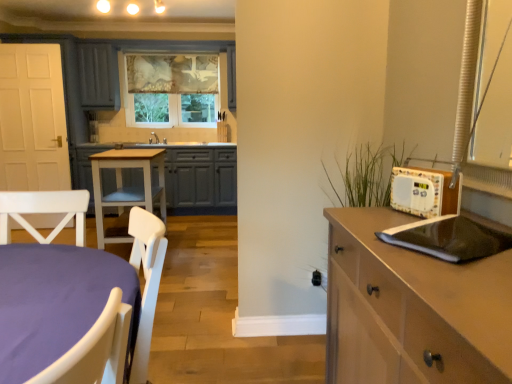
What do you see at coordinates (201, 179) in the screenshot?
I see `matte gray cabinet at center, positioned as the first cabinetry in top-to-bottom order` at bounding box center [201, 179].

At what (x,y) coordinates should I click in order to perform the action: click on textured fabric window at center. Please return your answer as a coordinate pair (x, y). This screenshot has width=512, height=384. Looking at the image, I should click on (170, 90).

Describe the element at coordinates (170, 90) in the screenshot. I see `textured fabric window at center` at that location.

The height and width of the screenshot is (384, 512). I want to click on matte gray cabinet at center, arranged as the second cabinetry when viewed from the right, so click(201, 179).

Locate an element on the screen. The height and width of the screenshot is (384, 512). kitchen appliance that is on the right side of white wood table at center is located at coordinates (448, 238).

Between white wood table at center and black matte laptop at right, which one appears on the left side from the viewer's perspective?

white wood table at center.

Looking at this image, is white wood table at center in front of black matte laptop at right?

No, the depth of white wood table at center is greater than that of black matte laptop at right.

Looking at this image, is the surface of white wood table at center in direct contact with black matte laptop at right?

No, white wood table at center is not making contact with black matte laptop at right.

How many degrees apart are the facing directions of light brown wood cabinet at right, which ranks as the 1th cabinetry in bottom-to-top order, and black matte laptop at right?

The angular difference between light brown wood cabinet at right, which ranks as the 1th cabinetry in bottom-to-top order, and black matte laptop at right is 33 degrees.

Is light brown wood cabinet at right, placed as the first cabinetry when sorted from right to left, to the left or to the right of black matte laptop at right in the image?

From the image, it's evident that light brown wood cabinet at right, placed as the first cabinetry when sorted from right to left, is to the left of black matte laptop at right.

From a real-world perspective, who is located higher, light brown wood cabinet at right, positioned as the 2th cabinetry in back-to-front order, or black matte laptop at right?

From a 3D spatial view, black matte laptop at right is above.

Looking at this image, which of these two, light brown wood cabinet at right, positioned as the 2th cabinetry in back-to-front order, or black matte laptop at right, is wider?

light brown wood cabinet at right, positioned as the 2th cabinetry in back-to-front order.

Locate an element on the screen. window above the matte gray cabinet at center, the 2th cabinetry when ordered from bottom to top (from a real-world perspective) is located at coordinates (170, 90).

Is matte gray cabinet at center, arranged as the second cabinetry when viewed from the right, positioned beyond the bounds of textured fabric window at center?

Absolutely, matte gray cabinet at center, arranged as the second cabinetry when viewed from the right, is external to textured fabric window at center.

In terms of height, does light brown wood cabinet at right, placed as the first cabinetry when sorted from right to left, look taller or shorter compared to matte gray cabinet at center, positioned as the first cabinetry in top-to-bottom order?

light brown wood cabinet at right, placed as the first cabinetry when sorted from right to left, is shorter than matte gray cabinet at center, positioned as the first cabinetry in top-to-bottom order.

Locate an element on the screen. cabinetry on the right of matte gray cabinet at center, the 2th cabinetry when ordered from bottom to top is located at coordinates (412, 309).

Does light brown wood cabinet at right, which appears as the second cabinetry when viewed from the left, have a lesser width compared to matte gray cabinet at center, the 2th cabinetry when ordered from bottom to top?

Indeed, light brown wood cabinet at right, which appears as the second cabinetry when viewed from the left, has a lesser width compared to matte gray cabinet at center, the 2th cabinetry when ordered from bottom to top.

Would you say light brown wood cabinet at right, the first cabinetry viewed from the front, is a long distance from matte gray cabinet at center, arranged as the second cabinetry when viewed from the right?

light brown wood cabinet at right, the first cabinetry viewed from the front, is positioned a significant distance from matte gray cabinet at center, arranged as the second cabinetry when viewed from the right.

Based on the photo, how different are the orientations of white wood table at center and matte gray cabinet at center, which ranks as the first cabinetry in left-to-right order, in degrees?

white wood table at center and matte gray cabinet at center, which ranks as the first cabinetry in left-to-right order, are facing 90.7 degrees away from each other.

Between white wood table at center and matte gray cabinet at center, arranged as the second cabinetry when viewed from the right, which one is positioned in front?

white wood table at center is more forward.

Is white wood table at center positioned beyond the bounds of matte gray cabinet at center, which ranks as the first cabinetry in left-to-right order?

Yes, white wood table at center is outside of matte gray cabinet at center, which ranks as the first cabinetry in left-to-right order.

In terms of width, does white wood table at center look wider or thinner when compared to matte gray cabinet at center, positioned as the first cabinetry in back-to-front order?

white wood table at center is thinner than matte gray cabinet at center, positioned as the first cabinetry in back-to-front order.

Is white wood table at center positioned with its back to textured fabric window at center?

No, white wood table at center is not facing the opposite direction of textured fabric window at center.

Can you confirm if white wood table at center is bigger than textured fabric window at center?

Correct, white wood table at center is larger in size than textured fabric window at center.

Which object is more forward, white wood table at center or textured fabric window at center?

white wood table at center is closer to the camera.

This screenshot has height=384, width=512. What are the coordinates of `window above the white wood table at center (from the image's perspective)` in the screenshot? It's located at (170, 90).

Who is shorter, black matte laptop at right or matte gray cabinet at center, the 2th cabinetry when ordered from bottom to top?

With less height is black matte laptop at right.

Which of these two, black matte laptop at right or matte gray cabinet at center, which ranks as the first cabinetry in left-to-right order, is wider?

matte gray cabinet at center, which ranks as the first cabinetry in left-to-right order, is wider.

Does black matte laptop at right come behind matte gray cabinet at center, arranged as the second cabinetry when viewed from the right?

No, it is in front of matte gray cabinet at center, arranged as the second cabinetry when viewed from the right.

Does point (433, 218) lie behind point (215, 195)?

No, (433, 218) is closer to viewer.

At what (x,y) coordinates should I click in order to perform the action: click on table behind the black matte laptop at right. Please return your answer as a coordinate pair (x, y). Looking at the image, I should click on (126, 188).

This screenshot has height=384, width=512. I want to click on cabinetry in front of the black matte laptop at right, so click(412, 309).

Considering their positions, is light brown wood cabinet at right, positioned as the 2th cabinetry in back-to-front order, positioned further to matte gray cabinet at center, positioned as the first cabinetry in top-to-bottom order, than white wood table at center?

light brown wood cabinet at right, positioned as the 2th cabinetry in back-to-front order.

In the scene shown: Which object lies nearer to the anchor point white wood table at center, matte gray cabinet at center, positioned as the first cabinetry in back-to-front order, or light brown wood cabinet at right, the first cabinetry viewed from the front?

Based on the image, matte gray cabinet at center, positioned as the first cabinetry in back-to-front order, appears to be nearer to white wood table at center.

Which object lies further to the anchor point white wood table at center, matte gray cabinet at center, arranged as the second cabinetry when viewed from the right, or black matte laptop at right?

black matte laptop at right.

Looking at the image, which one is located further to textured fabric window at center, matte gray cabinet at center, arranged as the second cabinetry when viewed from the right, or light brown wood cabinet at right, which appears as the second cabinetry when viewed from the left?

light brown wood cabinet at right, which appears as the second cabinetry when viewed from the left, lies further to textured fabric window at center than the other object.

Which object lies further to the anchor point textured fabric window at center, white wood table at center or matte gray cabinet at center, the 2th cabinetry when ordered from bottom to top?

white wood table at center is positioned further to the anchor textured fabric window at center.

Estimate the real-world distances between objects in this image. Which object is further from matte gray cabinet at center, positioned as the first cabinetry in back-to-front order, textured fabric window at center or white wood table at center?

Based on the image, white wood table at center appears to be further to matte gray cabinet at center, positioned as the first cabinetry in back-to-front order.

Based on their spatial positions, is textured fabric window at center or matte gray cabinet at center, positioned as the first cabinetry in back-to-front order, closer to white wood table at center?

The object closer to white wood table at center is matte gray cabinet at center, positioned as the first cabinetry in back-to-front order.

Considering their positions, is matte gray cabinet at center, the 2th cabinetry when ordered from bottom to top, positioned further to light brown wood cabinet at right, the first cabinetry viewed from the front, than white wood table at center?

matte gray cabinet at center, the 2th cabinetry when ordered from bottom to top, is further to light brown wood cabinet at right, the first cabinetry viewed from the front.

Find the location of `kitchen appliance between light brown wood cabinet at right, which appears as the second cabinetry when viewed from the left, and textured fabric window at center from front to back`. kitchen appliance between light brown wood cabinet at right, which appears as the second cabinetry when viewed from the left, and textured fabric window at center from front to back is located at coordinates (448, 238).

Find the location of a particular element. table between black matte laptop at right and textured fabric window at center in the front-back direction is located at coordinates (126, 188).

The height and width of the screenshot is (384, 512). I want to click on table between light brown wood cabinet at right, the first cabinetry viewed from the front, and matte gray cabinet at center, which appears as the second cabinetry when viewed from the front, in the front-back direction, so click(x=126, y=188).

You are a GUI agent. You are given a task and a screenshot of the screen. Output one action in this format:
    pyautogui.click(x=<x>, y=<y>)
    Task: Click on the table positioned between black matte laptop at right and matte gray cabinet at center, positioned as the first cabinetry in top-to-bottom order, from near to far
    Image resolution: width=512 pixels, height=384 pixels.
    Given the screenshot: What is the action you would take?
    pyautogui.click(x=126, y=188)